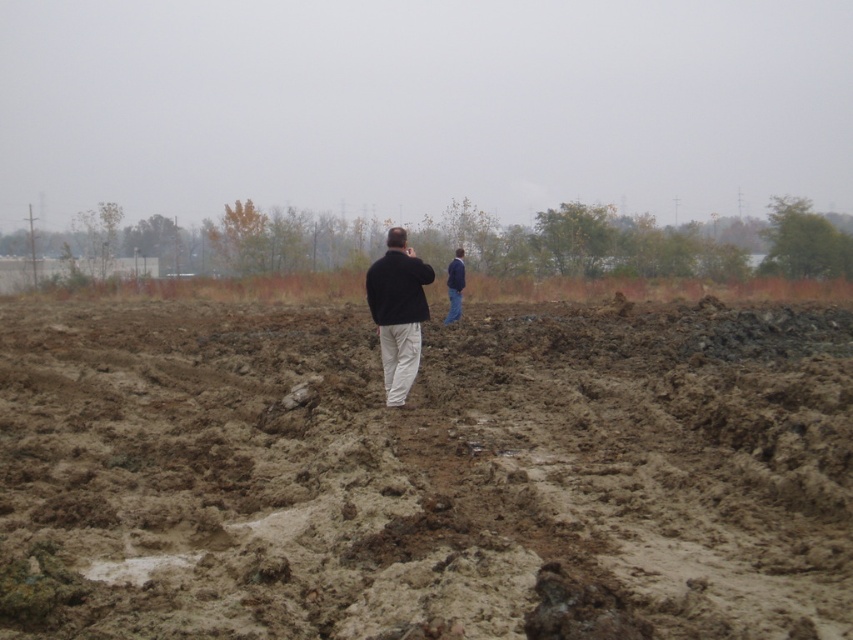
You are a photographer trying to capture a wide shot of the brown muddy field at center while also including the blue denim jacket at center in the frame. Since the field is larger, will you need to adjust your camera angle to focus more on the jacket?

The brown muddy field at center is bigger than the blue denim jacket at center, so you should position the camera to ensure the jacket is centered and use a wider lens to include both the large field and the jacket in the frame.

You are standing in the muddy field and want to take a photo of both the matte black jacket at center and the blue denim jacket at center. Which jacket should you adjust to be closer to the camera so that both are in the frame?

The matte black jacket at center is already positioned to the left of the blue denim jacket at center, so you can move the blue denim jacket at center closer to the camera to ensure both are in the frame.

You are planning to hang both jackets on a single hanger that can only hold one item. Based on their widths, which jacket from the matte black jacket at center and the blue denim jacket at center should you choose to fit properly?

The blue denim jacket at center is narrower than the matte black jacket at center, so the blue denim jacket at center should be chosen to fit properly on the hanger.